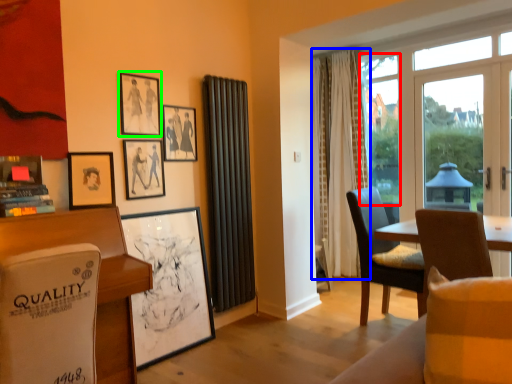
Question: Which is farther away from window screen (highlighted by a red box)? curtain (highlighted by a blue box) or picture frame (highlighted by a green box)?

Choices:
 (A) curtain
 (B) picture frame

Answer: (B)